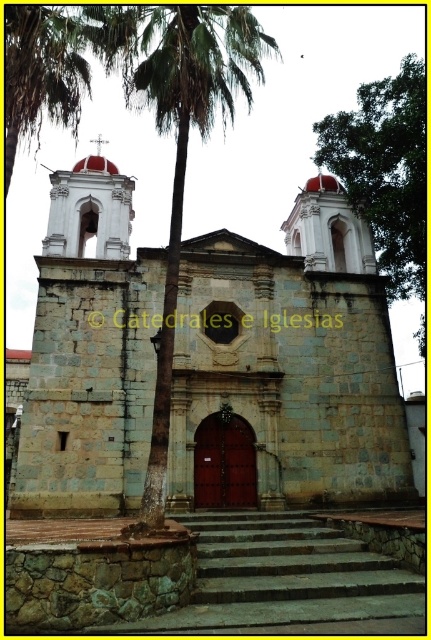
Based on the photo, you are standing in front of the historic church and want to take a photo of the point at coordinate (336, 193). The camera you are using has a maximum focus range of 80 meters. Will the camera be able to focus on the point?

The point at coordinate (336, 193) is 80.41 meters away from the camera. Since the camera can only focus up to 80 meters, it will not be able to focus on the point as it is slightly beyond the maximum range.

Looking at this image, you are standing at the entrance of the historic church and want to walk towards the point marked as point (372, 132). However, there is an obstacle at point marked as point (359, 403). Will you encounter this obstacle before reaching your destination?

Yes, you will encounter the obstacle at point (359, 403) before reaching your destination at point (372, 132) because point (359, 403) is in front of point (372, 132).

You are a photographer planning to take a picture of the stone church at center and the green leafy palm tree at center. From your current position, can you see both objects fully in the frame without any obstruction?

The green leafy palm tree at center is behind the stone church at center, so the palm tree will be partially or fully obstructed by the church, making it impossible to see both objects fully in the frame without any obstruction.